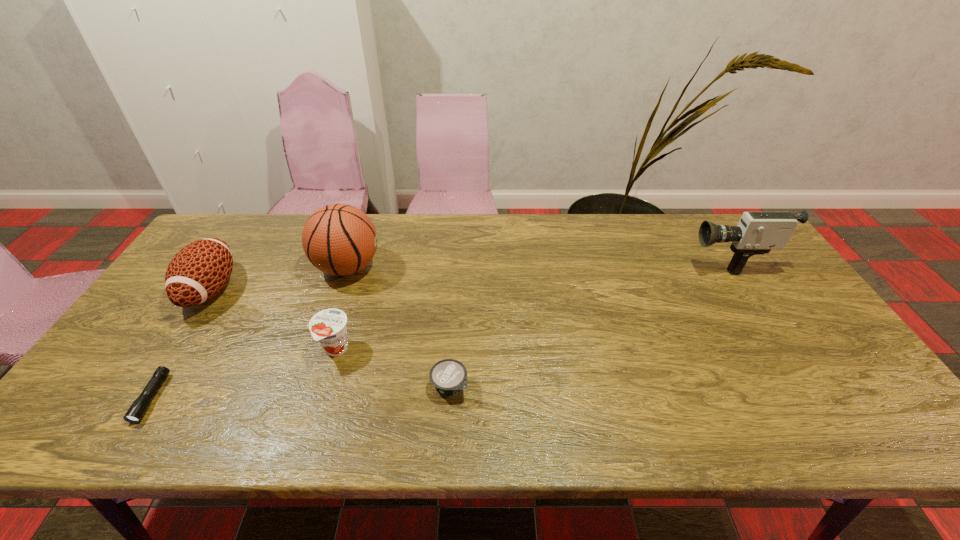
In order to click on basketball in this screenshot , I will do `click(339, 239)`.

Locate an element on the screen. The image size is (960, 540). camcorder is located at coordinates (757, 233).

The width and height of the screenshot is (960, 540). In order to click on football in this screenshot , I will do `click(199, 271)`.

The width and height of the screenshot is (960, 540). What are the coordinates of `the left yogurt` in the screenshot? It's located at (328, 326).

At what (x,y) coordinates should I click in order to perform the action: click on the taller yogurt. Please return your answer as a coordinate pair (x, y). This screenshot has height=540, width=960. Looking at the image, I should click on (328, 326).

The image size is (960, 540). Find the location of `the second shortest object`. the second shortest object is located at coordinates pos(449,376).

Locate an element on the screen. the nearer yogurt is located at coordinates (449, 376).

What are the coordinates of `the shortest object` in the screenshot? It's located at (137, 410).

The width and height of the screenshot is (960, 540). Identify the location of vacant space located 0.270m on the side where the inflation valve is located. (469, 267).

Locate an element on the screen. The height and width of the screenshot is (540, 960). vacant area situated 0.170m on the recording direction of the rightmost object is located at coordinates (629, 258).